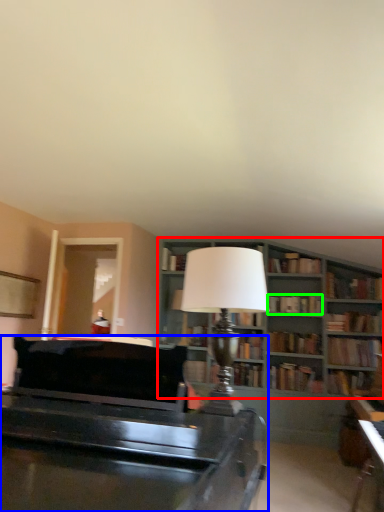
Question: Which is farther away from bookcase (highlighted by a red box)? piano (highlighted by a blue box) or book (highlighted by a green box)?

Choices:
 (A) piano
 (B) book

Answer: (A)